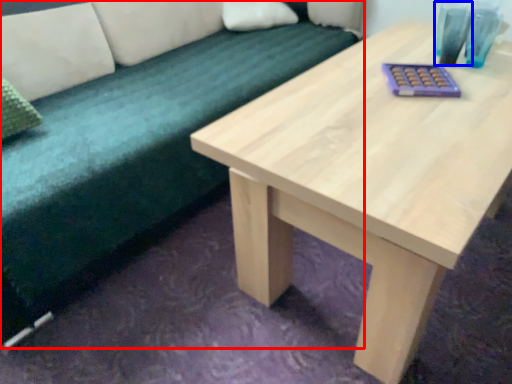
Question: Which of the following is the closest to the observer, studio couch (highlighted by a red box) or glass vase (highlighted by a blue box)?

Choices:
 (A) studio couch
 (B) glass vase

Answer: (A)